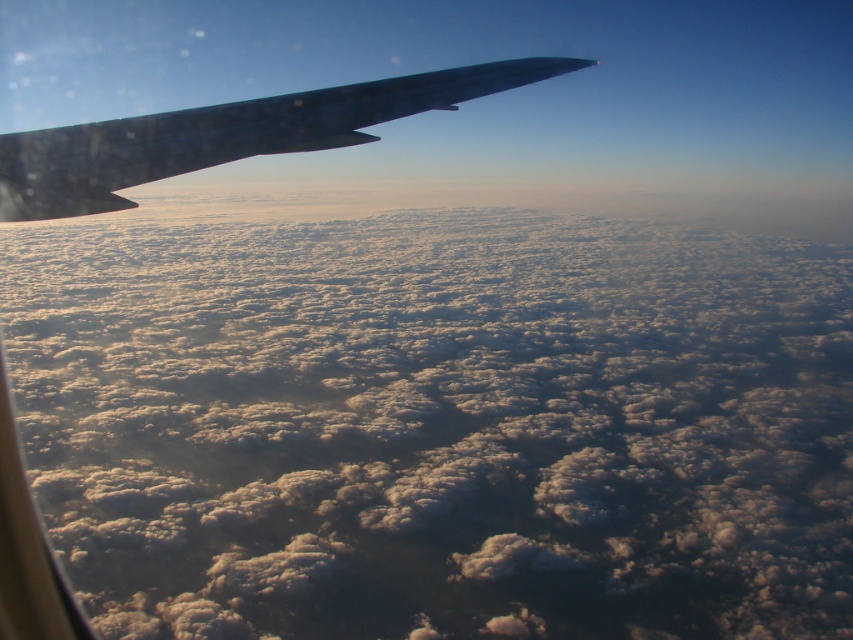
Can you confirm if white fluffy cloud at upper center is taller than glossy metallic wing at upper left?

Yes.

Does white fluffy cloud at upper center appear under glossy metallic wing at upper left?

Indeed, white fluffy cloud at upper center is positioned under glossy metallic wing at upper left.

The height and width of the screenshot is (640, 853). In order to click on white fluffy cloud at upper center in this screenshot , I will do `click(436, 424)`.

This screenshot has height=640, width=853. What are the coordinates of `white fluffy cloud at upper center` in the screenshot? It's located at (436, 424).